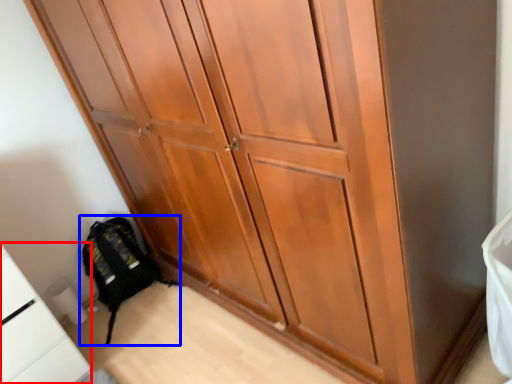
Question: Which of the following is the closest to the observer, cabinetry (highlighted by a red box) or backpack (highlighted by a blue box)?

Choices:
 (A) cabinetry
 (B) backpack

Answer: (A)